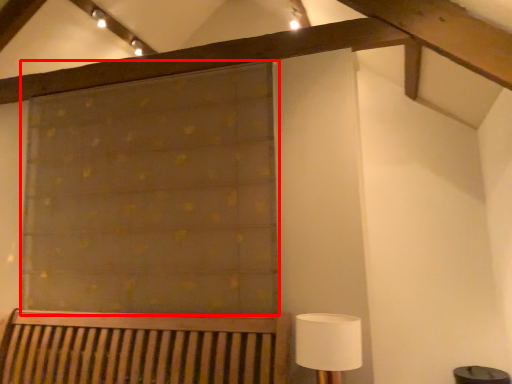
Question: Considering the relative positions of curtain (annotated by the red box) and table lamp in the image provided, where is curtain (annotated by the red box) located with respect to the staircase?

Choices:
 (A) right
 (B) left

Answer: (B)